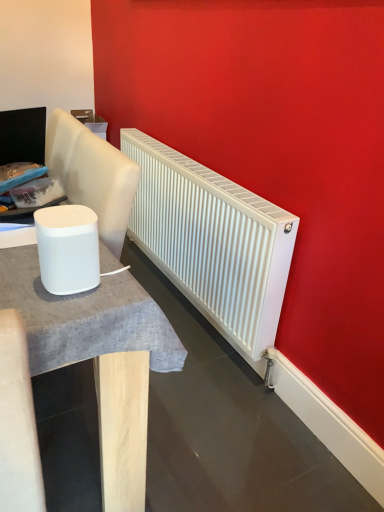
Find the location of `free space to the left of white matte speaker at left`. free space to the left of white matte speaker at left is located at coordinates (17, 270).